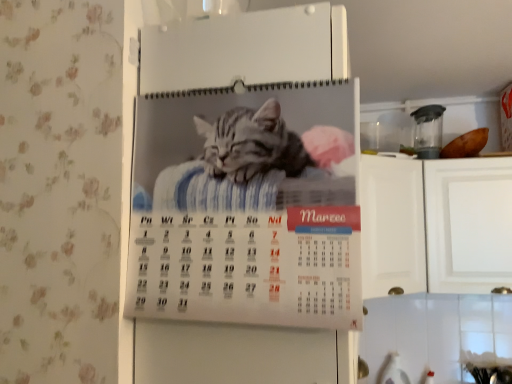
Question: Considering the relative sizes of transparent plastic blender at upper right, arranged as the 2th appliance when ordered from the bottom, and white glossy calendar at center, which ranks as the first appliance in front-to-back order, in the image provided, is transparent plastic blender at upper right, arranged as the 2th appliance when ordered from the bottom, thinner than white glossy calendar at center, which ranks as the first appliance in front-to-back order,?

Choices:
 (A) no
 (B) yes

Answer: (B)

Question: Considering the relative sizes of transparent plastic blender at upper right, which ranks as the first appliance in right-to-left order, and white glossy calendar at center, which ranks as the 2th appliance in top-to-bottom order, in the image provided, is transparent plastic blender at upper right, which ranks as the first appliance in right-to-left order, shorter than white glossy calendar at center, which ranks as the 2th appliance in top-to-bottom order,?

Choices:
 (A) yes
 (B) no

Answer: (A)

Question: From the image's perspective, is transparent plastic blender at upper right, arranged as the 2th appliance when ordered from the bottom, below white glossy calendar at center, which appears as the second appliance when viewed from the right?

Choices:
 (A) yes
 (B) no

Answer: (B)

Question: Can you confirm if transparent plastic blender at upper right, the 1th appliance from the back, is positioned to the right of white glossy calendar at center, which ranks as the first appliance in front-to-back order?

Choices:
 (A) no
 (B) yes

Answer: (B)

Question: From the image's perspective, does transparent plastic blender at upper right, the 1th appliance from the back, appear higher than white glossy calendar at center, which ranks as the first appliance in bottom-to-top order?

Choices:
 (A) yes
 (B) no

Answer: (A)

Question: Considering the relative sizes of transparent plastic blender at upper right, which ranks as the first appliance in right-to-left order, and white glossy calendar at center, which ranks as the first appliance in bottom-to-top order, in the image provided, is transparent plastic blender at upper right, which ranks as the first appliance in right-to-left order, smaller than white glossy calendar at center, which ranks as the first appliance in bottom-to-top order,?

Choices:
 (A) no
 (B) yes

Answer: (B)

Question: Considering the relative positions of white glossy calendar at center, which is the 2th appliance in back-to-front order, and transparent plastic blender at upper right, positioned as the first appliance in top-to-bottom order, in the image provided, is white glossy calendar at center, which is the 2th appliance in back-to-front order, to the right of transparent plastic blender at upper right, positioned as the first appliance in top-to-bottom order, from the viewer's perspective?

Choices:
 (A) no
 (B) yes

Answer: (A)

Question: Can you confirm if white glossy calendar at center, which ranks as the first appliance in bottom-to-top order, is positioned to the left of transparent plastic blender at upper right, positioned as the first appliance in top-to-bottom order?

Choices:
 (A) yes
 (B) no

Answer: (A)

Question: Is white glossy calendar at center, which is counted as the first appliance, starting from the left, facing away from transparent plastic blender at upper right, positioned as the first appliance in top-to-bottom order?

Choices:
 (A) yes
 (B) no

Answer: (B)

Question: From a real-world perspective, is white glossy calendar at center, which is counted as the first appliance, starting from the left, located beneath transparent plastic blender at upper right, arranged as the 2th appliance when ordered from the bottom?

Choices:
 (A) yes
 (B) no

Answer: (A)

Question: From the image's perspective, is white glossy calendar at center, which ranks as the first appliance in bottom-to-top order, on top of transparent plastic blender at upper right, the second appliance viewed from the left?

Choices:
 (A) no
 (B) yes

Answer: (A)

Question: Does white glossy calendar at center, which ranks as the first appliance in bottom-to-top order, have a greater height compared to transparent plastic blender at upper right, the 1th appliance from the back?

Choices:
 (A) no
 (B) yes

Answer: (B)

Question: Looking at the image, does white glossy calendar at center, which is the 2th appliance in back-to-front order, seem bigger or smaller compared to transparent plastic blender at upper right, positioned as the first appliance in top-to-bottom order?

Choices:
 (A) small
 (B) big

Answer: (B)